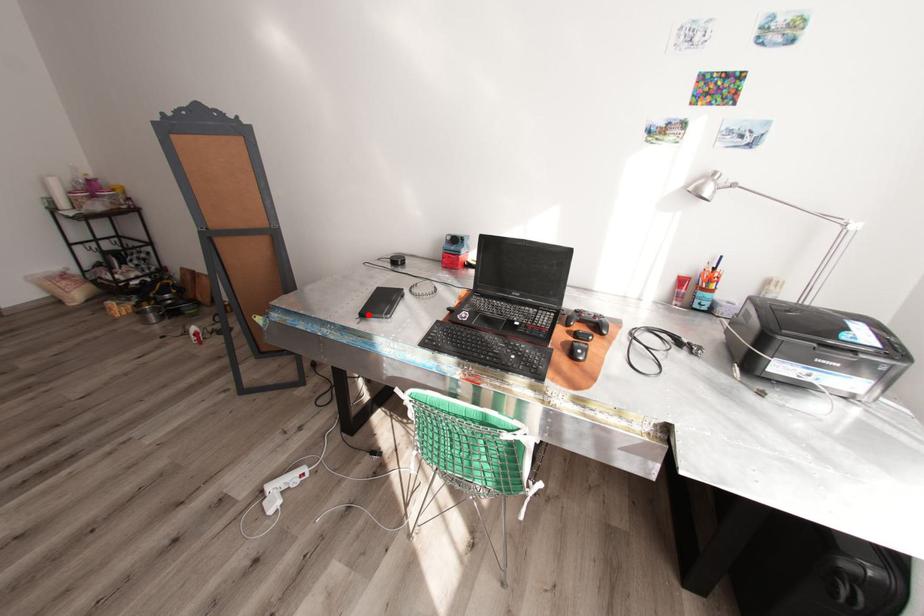
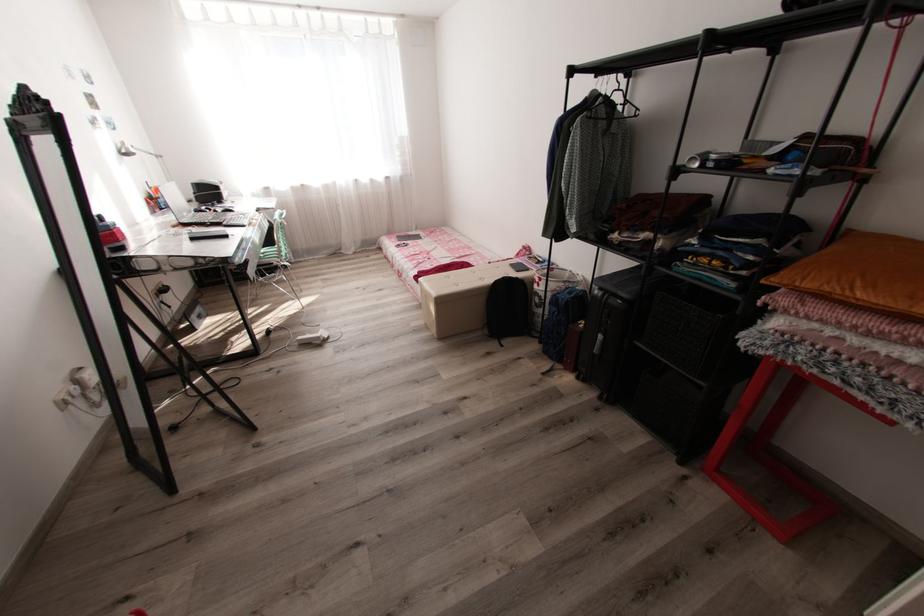
Question: A red point is marked in image1. In image2, is the corresponding 3D point closer to the camera or farther? Reply with the corresponding letter.

Choices:
 (A) The corresponding 3D point is closer.
 (B) The corresponding 3D point is farther.

Answer: (A)